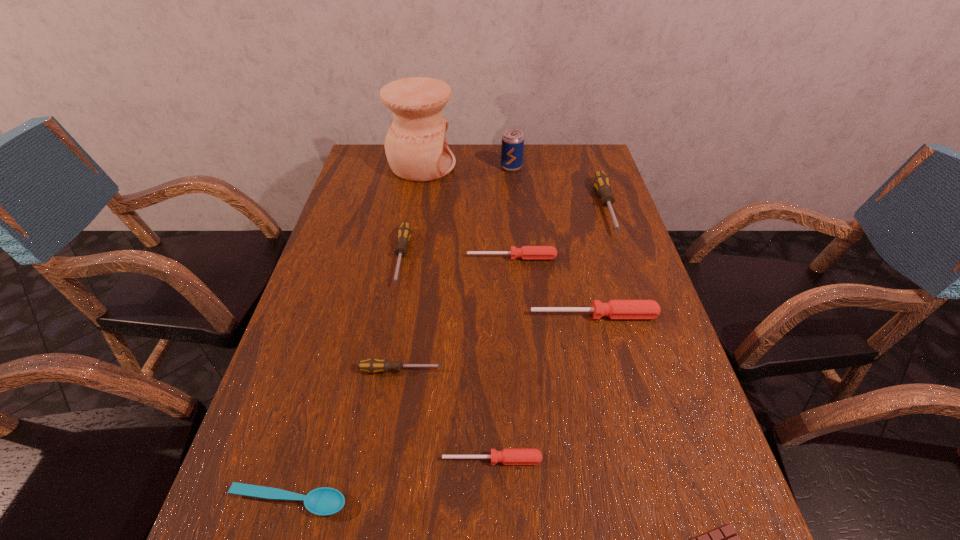
Where is `object that is positioned at the far right corner`? object that is positioned at the far right corner is located at coordinates (601, 182).

This screenshot has height=540, width=960. In the image, there is a desktop. Identify the location of vacant space at the far edge. (460, 150).

I want to click on blank space at the left edge of the desktop, so coord(293,453).

The width and height of the screenshot is (960, 540). In the image, there is a desktop. What are the coordinates of `free space at the right edge` in the screenshot? It's located at [x=612, y=279].

Identify the location of free region at the far left corner of the desktop. The width and height of the screenshot is (960, 540). (387, 166).

Image resolution: width=960 pixels, height=540 pixels. I want to click on free area in between the beer can and the second biggest gray screwdriver, so click(x=457, y=212).

I want to click on free space between the second biggest red screwdriver and the seventh farthest object, so click(456, 314).

Locate an element on the screen. empty space that is in between the sixth farthest object and the second smallest gray screwdriver is located at coordinates (498, 287).

Find the location of a particular element. vacant region between the fourth farthest screwdriver and the smallest gray screwdriver is located at coordinates (497, 343).

I want to click on blank region between the second nearest red screwdriver and the second smallest gray screwdriver, so click(498, 287).